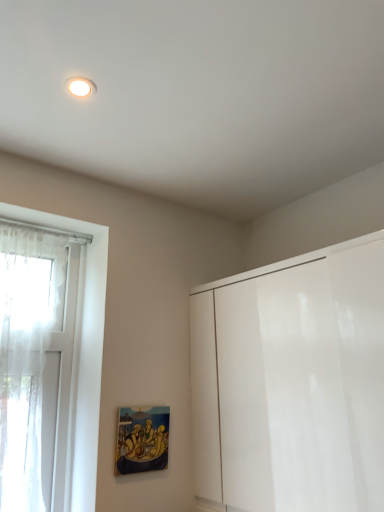
Where is `matte wooden picture frame at lower center`? matte wooden picture frame at lower center is located at coordinates (142, 440).

Describe the element at coordinates (142, 440) in the screenshot. I see `matte wooden picture frame at lower center` at that location.

This screenshot has height=512, width=384. What are the coordinates of `matte wooden picture frame at lower center` in the screenshot? It's located at (142, 440).